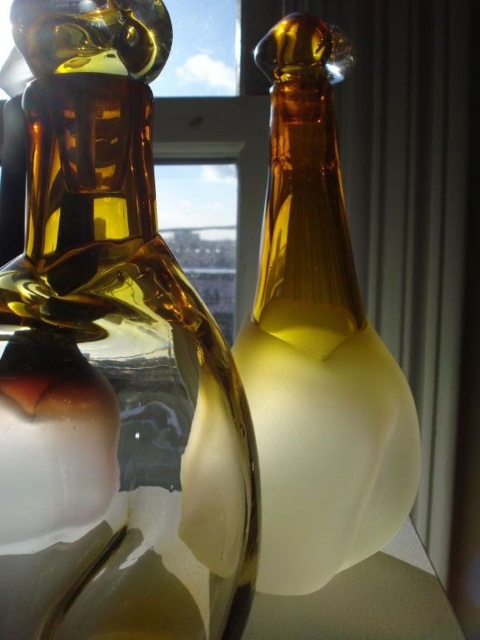
Question: Among these objects, which one is nearest to the camera?

Choices:
 (A) white matte glass table at lower center
 (B) amber glass vase at left
 (C) amber glass bottle at center

Answer: (B)

Question: Which of these objects is positioned closest to the amber glass bottle at center?

Choices:
 (A) white matte glass table at lower center
 (B) amber glass vase at left

Answer: (B)

Question: Is amber glass vase at left thinner than white matte glass table at lower center?

Choices:
 (A) no
 (B) yes

Answer: (B)

Question: In this image, where is amber glass bottle at center located relative to white matte glass table at lower center?

Choices:
 (A) below
 (B) above

Answer: (B)

Question: Does amber glass vase at left appear on the right side of white matte glass table at lower center?

Choices:
 (A) no
 (B) yes

Answer: (A)

Question: Estimate the real-world distances between objects in this image. Which object is farther from the amber glass bottle at center?

Choices:
 (A) amber glass vase at left
 (B) white matte glass table at lower center

Answer: (B)